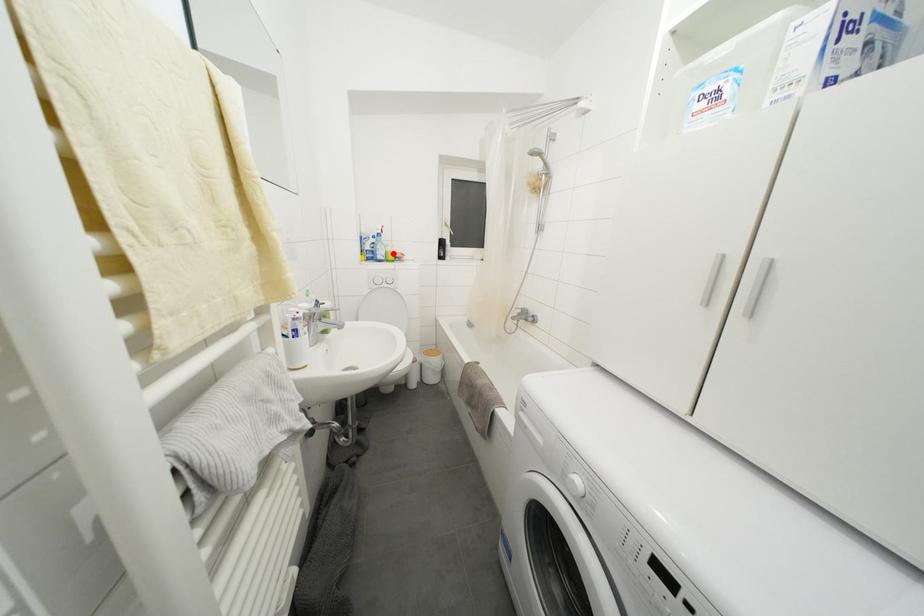
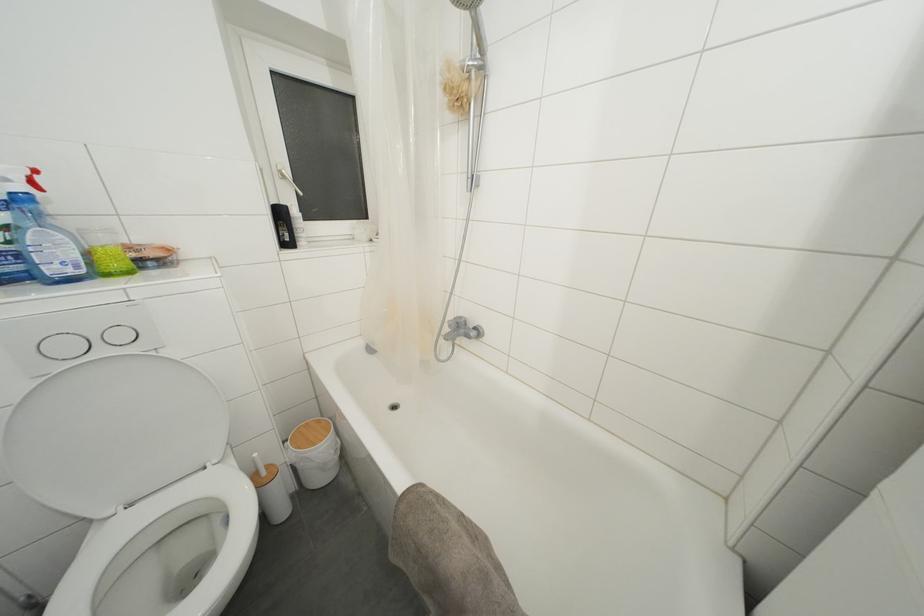
Question: I am providing you with two images of the same scene from different viewpoints. In image1, a red point is highlighted. Considering the same 3D point in image2, which of the following is correct?

Choices:
 (A) It is closer
 (B) It is farther

Answer: (B)